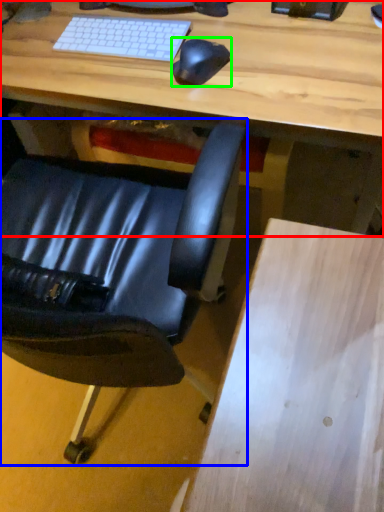
Question: Which is nearer to the desk (highlighted by a red box)? chair (highlighted by a blue box) or mouse (highlighted by a green box).

Choices:
 (A) chair
 (B) mouse

Answer: (B)